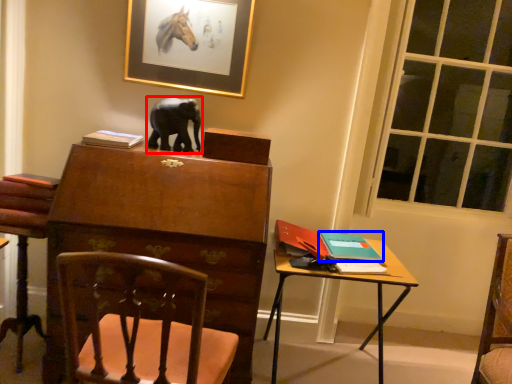
Question: Which point is further to the camera, elephant (highlighted by a red box) or book (highlighted by a blue box)?

Choices:
 (A) elephant
 (B) book

Answer: (A)